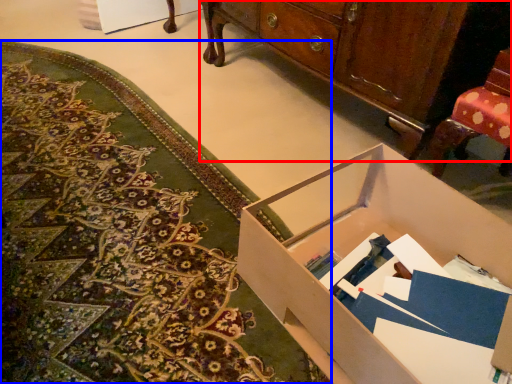
Question: Which point is further to the camera, cabinetry (highlighted by a red box) or mat (highlighted by a blue box)?

Choices:
 (A) cabinetry
 (B) mat

Answer: (A)